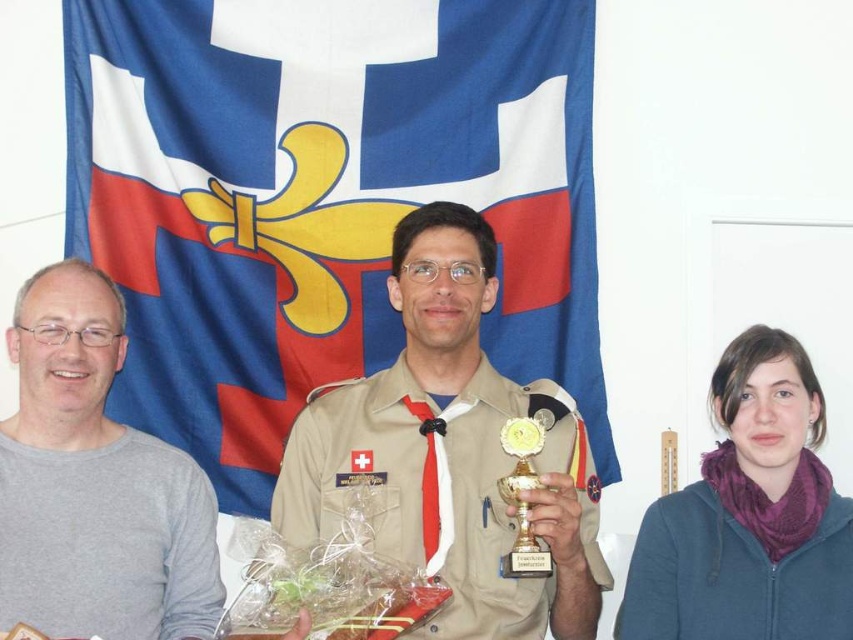
Question: Which point appears farthest from the camera in this image?

Choices:
 (A) (392, 406)
 (B) (585, 422)
 (C) (549, 576)

Answer: (B)

Question: Which is farther from the khaki uniform at center?

Choices:
 (A) purple fleece scarf at lower right
 (B) gray matte sweater at left

Answer: (B)

Question: Can you confirm if gray matte sweater at left is positioned below purple fleece scarf at lower right?

Choices:
 (A) yes
 (B) no

Answer: (B)

Question: Which of the following is the farthest from the observer?

Choices:
 (A) purple fleece scarf at lower right
 (B) khaki uniform at center
 (C) gold metallic trophy at center

Answer: (A)

Question: Is blue fabric flag at upper center wider than purple fleece scarf at lower right?

Choices:
 (A) no
 (B) yes

Answer: (B)

Question: Can you confirm if purple fleece scarf at lower right is wider than gold metallic trophy at center?

Choices:
 (A) no
 (B) yes

Answer: (B)